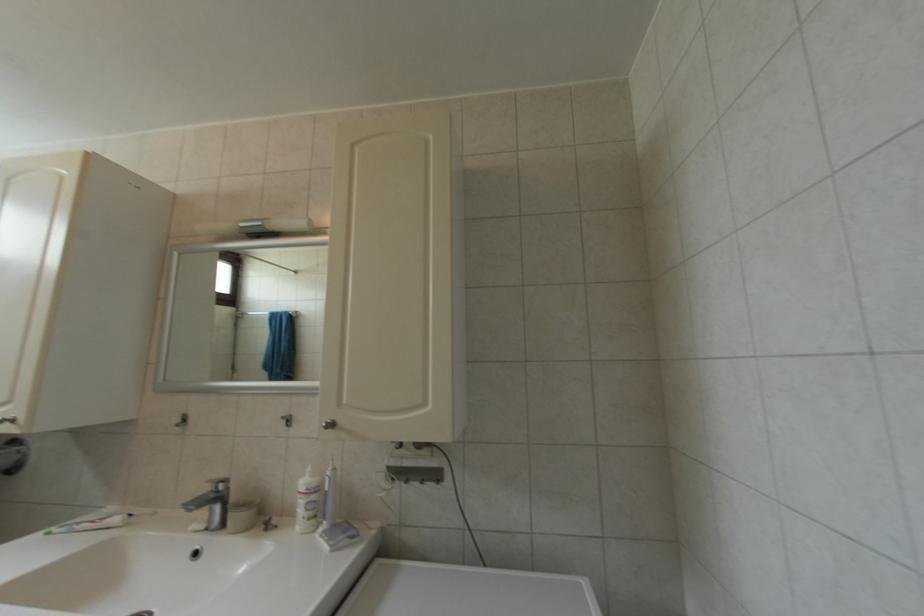
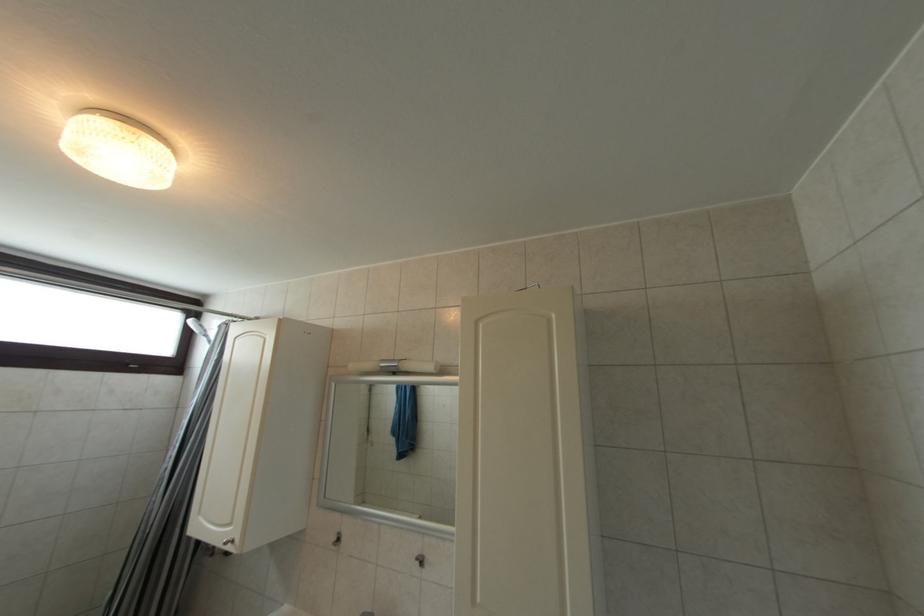
Question: The camera is either moving clockwise (left) or counter-clockwise (right) around the object. The first image is from the beginning of the video and the second image is from the end. Is the camera moving left or right when shooting the video?

Choices:
 (A) Left
 (B) Right

Answer: (B)